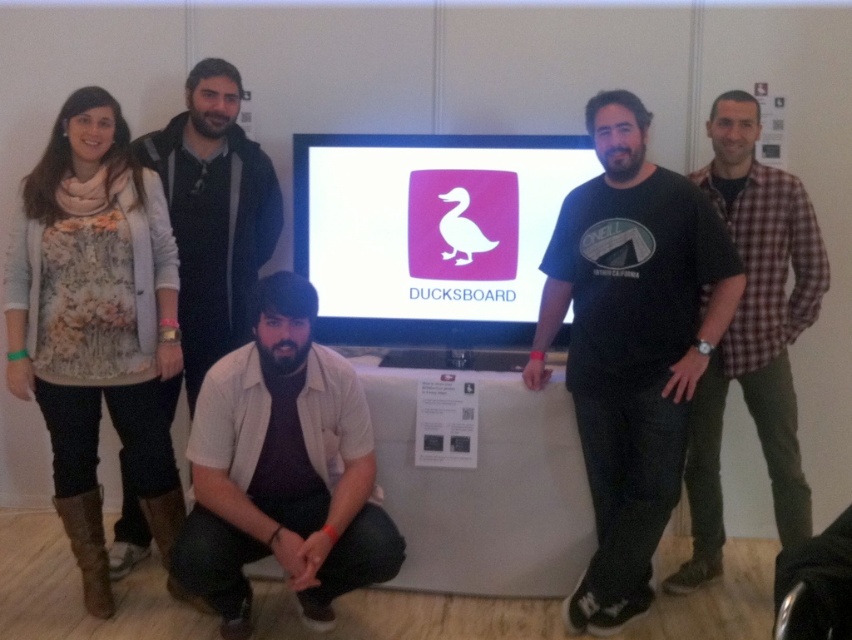
Is black cotton t-shirt at center smaller than plaid shirt at right?

Correct, black cotton t-shirt at center occupies less space than plaid shirt at right.

Who is more forward, (735,273) or (722,518)?

Point (735,273) is more forward.

Which is in front, point (699, 376) or point (804, 509)?

Positioned in front is point (699, 376).

Where is `black cotton t-shirt at center`? This screenshot has width=852, height=640. black cotton t-shirt at center is located at coordinates click(x=630, y=344).

Does white glossy screen at center come behind plaid shirt at right?

That is True.

The height and width of the screenshot is (640, 852). What do you see at coordinates (429, 232) in the screenshot? I see `white glossy screen at center` at bounding box center [429, 232].

The image size is (852, 640). Identify the location of white glossy screen at center. (429, 232).

Is point (556, 326) closer to camera compared to point (237, 92)?

That is True.

At what (x,y) coordinates should I click in order to perform the action: click on black cotton t-shirt at center. Please return your answer as a coordinate pair (x, y). This screenshot has width=852, height=640. Looking at the image, I should click on (630, 344).

Is point (573, 611) farther from camera compared to point (222, 275)?

No, it is not.

The height and width of the screenshot is (640, 852). Identify the location of black cotton t-shirt at center. (630, 344).